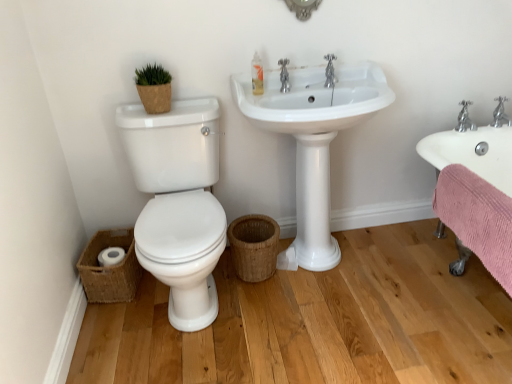
Image resolution: width=512 pixels, height=384 pixels. Find the location of `vacant area that is in front of woven brown basket at lower left, which is counted as the 2th basket, starting from the right`. vacant area that is in front of woven brown basket at lower left, which is counted as the 2th basket, starting from the right is located at coordinates (118, 326).